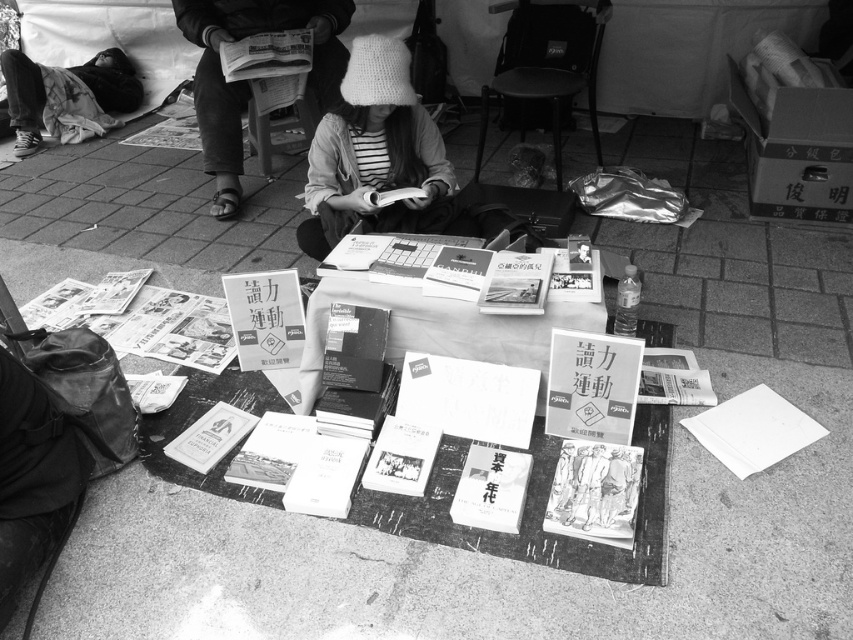
What do you see at coordinates (374, 152) in the screenshot? I see `white knitted hat at center` at bounding box center [374, 152].

Can you confirm if white knitted hat at center is taller than white paper at lower right?

Yes, white knitted hat at center is taller than white paper at lower right.

Is point (404, 198) more distant than point (769, 408)?

Yes.

At what (x,y) coordinates should I click in order to perform the action: click on white knitted hat at center. Please return your answer as a coordinate pair (x, y). The height and width of the screenshot is (640, 853). Looking at the image, I should click on (374, 152).

Is white knit hat at upper center bigger than white paper at lower right?

Yes.

Looking at this image, is white knit hat at upper center further to camera compared to white paper at lower right?

Yes, white knit hat at upper center is behind white paper at lower right.

Locate an element on the screen. This screenshot has height=640, width=853. white knit hat at upper center is located at coordinates (247, 81).

From the picture: Which is more to the left, white knitted hat at center or white knit hat at upper center?

From the viewer's perspective, white knit hat at upper center appears more on the left side.

Is point (393, 148) less distant than point (280, 10)?

Yes, point (393, 148) is closer to viewer.

This screenshot has height=640, width=853. Describe the element at coordinates (374, 152) in the screenshot. I see `white knitted hat at center` at that location.

At what (x,y) coordinates should I click in order to perform the action: click on white knitted hat at center. Please return your answer as a coordinate pair (x, y). Looking at the image, I should click on (374, 152).